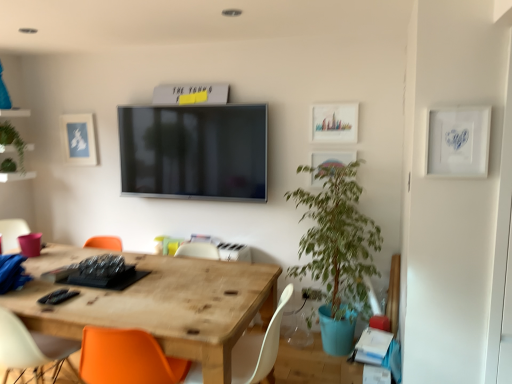
Question: From a real-world perspective, is wooden table at center positioned over white matte chair at lower center based on gravity?

Choices:
 (A) yes
 (B) no

Answer: (B)

Question: Is wooden table at center located outside white matte chair at lower center?

Choices:
 (A) yes
 (B) no

Answer: (A)

Question: From a real-world perspective, is wooden table at center physically below white matte chair at lower center?

Choices:
 (A) no
 (B) yes

Answer: (B)

Question: Is there a large distance between wooden table at center and white matte chair at lower center?

Choices:
 (A) yes
 (B) no

Answer: (B)

Question: Is wooden table at center to the right of white matte chair at lower center from the viewer's perspective?

Choices:
 (A) yes
 (B) no

Answer: (B)

Question: Is wooden table at center aimed at white matte chair at lower center?

Choices:
 (A) no
 (B) yes

Answer: (A)

Question: From the image's perspective, does matte blue paper at upper left appear lower than white matte chair at lower center?

Choices:
 (A) no
 (B) yes

Answer: (A)

Question: Considering the relative sizes of matte blue paper at upper left and white matte chair at lower center in the image provided, is matte blue paper at upper left wider than white matte chair at lower center?

Choices:
 (A) yes
 (B) no

Answer: (B)

Question: Is matte blue paper at upper left outside of white matte chair at lower center?

Choices:
 (A) no
 (B) yes

Answer: (B)

Question: Can you confirm if matte blue paper at upper left is positioned to the right of white matte chair at lower center?

Choices:
 (A) yes
 (B) no

Answer: (B)

Question: Is white matte chair at lower center surrounded by matte blue paper at upper left?

Choices:
 (A) yes
 (B) no

Answer: (B)

Question: From a real-world perspective, is matte blue paper at upper left located beneath white matte chair at lower center?

Choices:
 (A) no
 (B) yes

Answer: (A)

Question: Is matte blue paper at upper left completely or partially outside of green leafy plant at left?

Choices:
 (A) yes
 (B) no

Answer: (A)